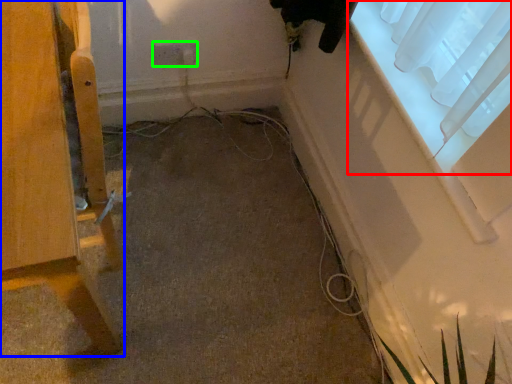
Question: Which object is positioned farthest from window (highlighted by a red box)? Select from furniture (highlighted by a blue box) and electric outlet (highlighted by a green box).

Choices:
 (A) furniture
 (B) electric outlet

Answer: (A)